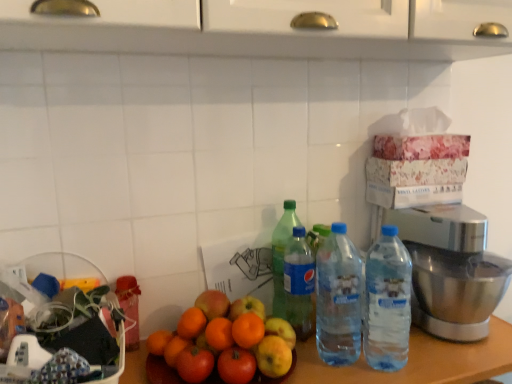
Question: Based on their sizes in the image, would you say translucent plastic bottle at center, placed as the 2th bottle when sorted from left to right, is bigger or smaller than green plastic bottle at center, arranged as the 4th bottle when viewed from the right?

Choices:
 (A) small
 (B) big

Answer: (A)

Question: Is translucent plastic bottle at center, placed as the 2th bottle when sorted from left to right, to the left or to the right of green plastic bottle at center, arranged as the 4th bottle when viewed from the right, in the image?

Choices:
 (A) left
 (B) right

Answer: (B)

Question: Which is nearer to the green plastic bottle at center, arranged as the 4th bottle when viewed from the right?

Choices:
 (A) wooden table at center
 (B) polished stainless steel mixer at right
 (C) shiny orange fruit at center
 (D) translucent plastic bottle at center, placed as the 2th bottle when sorted from left to right
 (E) blue plastic water bottle at center, placed as the second bottle when sorted from right to left

Answer: (D)

Question: Estimate the real-world distances between objects in this image. Which object is farther from the shiny orange fruit at center?

Choices:
 (A) translucent plastic bottle at center, arranged as the third bottle when viewed from the right
 (B) clear plastic water bottles at center-right, placed as the 4th bottle when sorted from left to right
 (C) wooden table at center
 (D) green plastic bottle at center, arranged as the 4th bottle when viewed from the right
 (E) polished stainless steel mixer at right

Answer: (E)